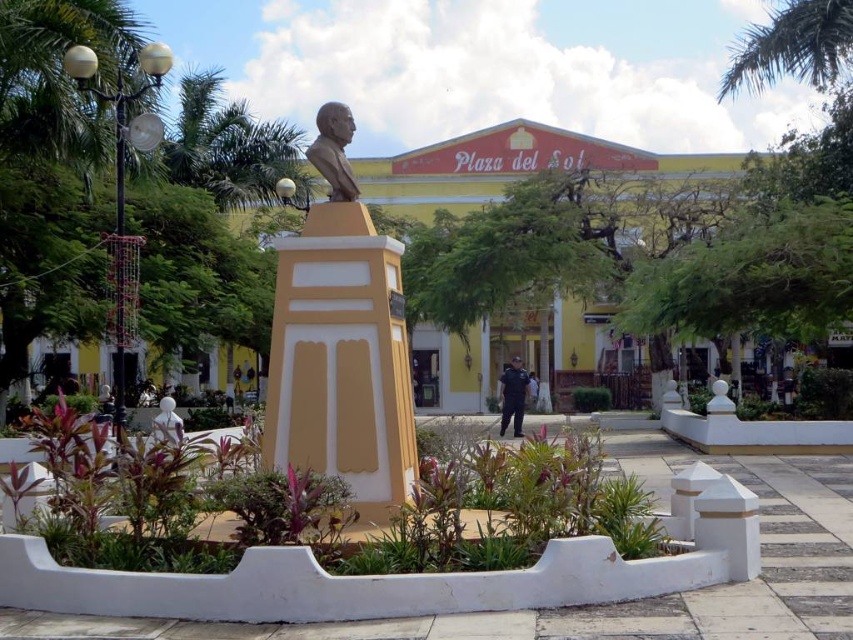
Question: Is matte gold bust at center above green leafy palm tree at upper right?

Choices:
 (A) yes
 (B) no

Answer: (B)

Question: Is green leafy palm tree at upper left thinner than blue uniform at center?

Choices:
 (A) no
 (B) yes

Answer: (A)

Question: Considering the real-world distances, which object is farthest from the bronze bust at center?

Choices:
 (A) green leafy palm tree at upper right
 (B) yellow matte building at center

Answer: (A)

Question: Among these objects, which one is farthest from the camera?

Choices:
 (A) bronze bust at center
 (B) yellow matte building at center
 (C) blue uniform at center
 (D) green leafy palm tree at upper left

Answer: (C)

Question: Does yellow matte building at center come in front of blue uniform at center?

Choices:
 (A) yes
 (B) no

Answer: (A)

Question: Which of the following is the farthest from the observer?

Choices:
 (A) (351, 289)
 (B) (231, 120)
 (C) (318, 157)
 (D) (752, 49)

Answer: (B)